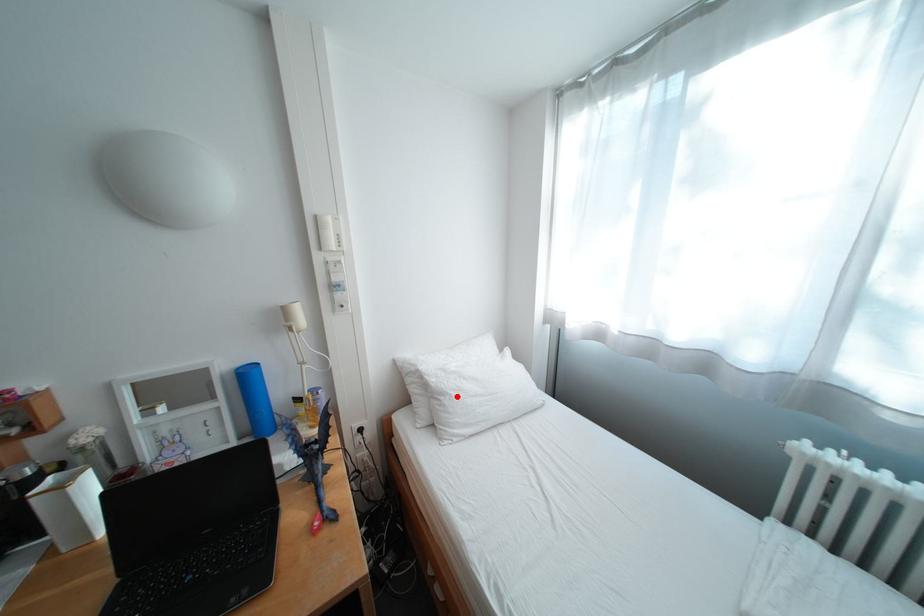
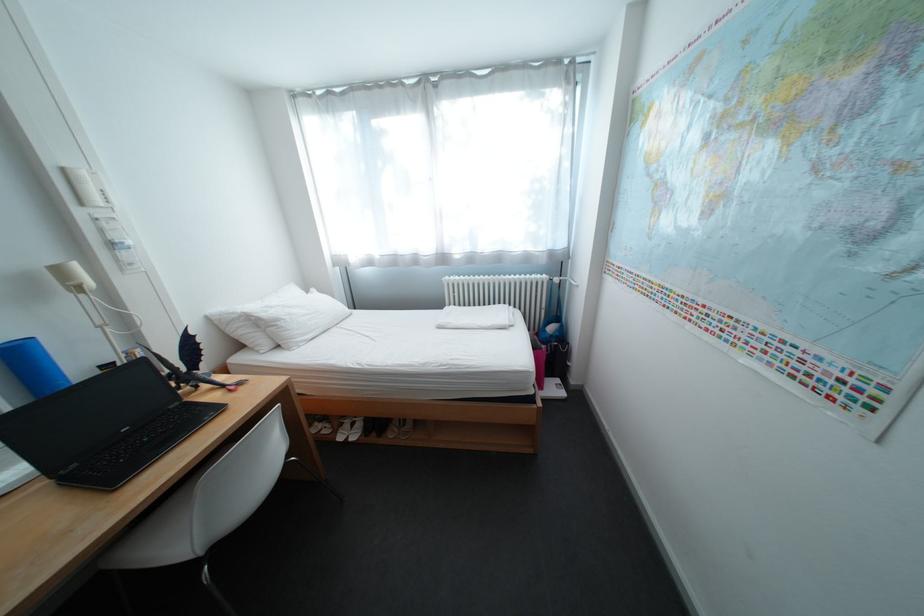
Question: I am providing you with two images of the same scene from different viewpoints. Given a red point in image1, look at the same physical point in image2. Is it:

Choices:
 (A) Closer to the viewpoint
 (B) Farther from the viewpoint

Answer: (A)